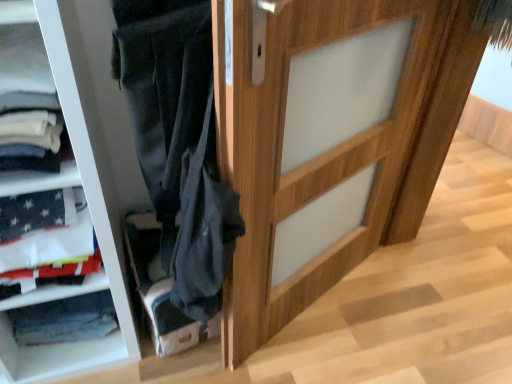
Find the location of a particular element. vacant space underneath wooden door at center (from a real-world perspective) is located at coordinates (312, 308).